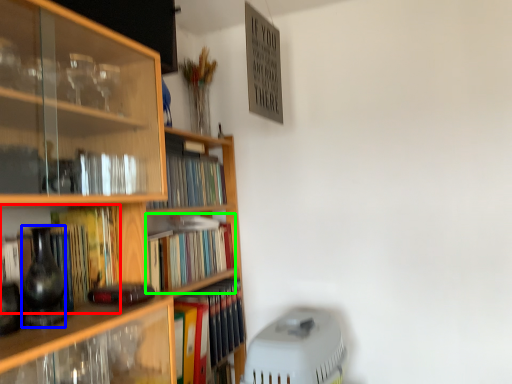
Question: Estimate the real-world distances between objects in this image. Which object is closer to book (highlighted by a red box), glass vase (highlighted by a blue box) or book (highlighted by a green box)?

Choices:
 (A) glass vase
 (B) book

Answer: (A)